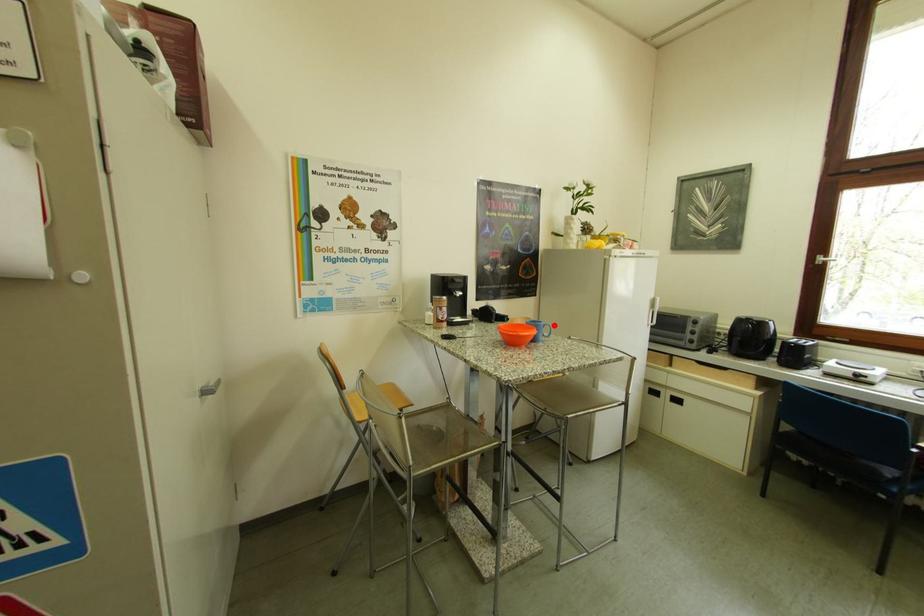
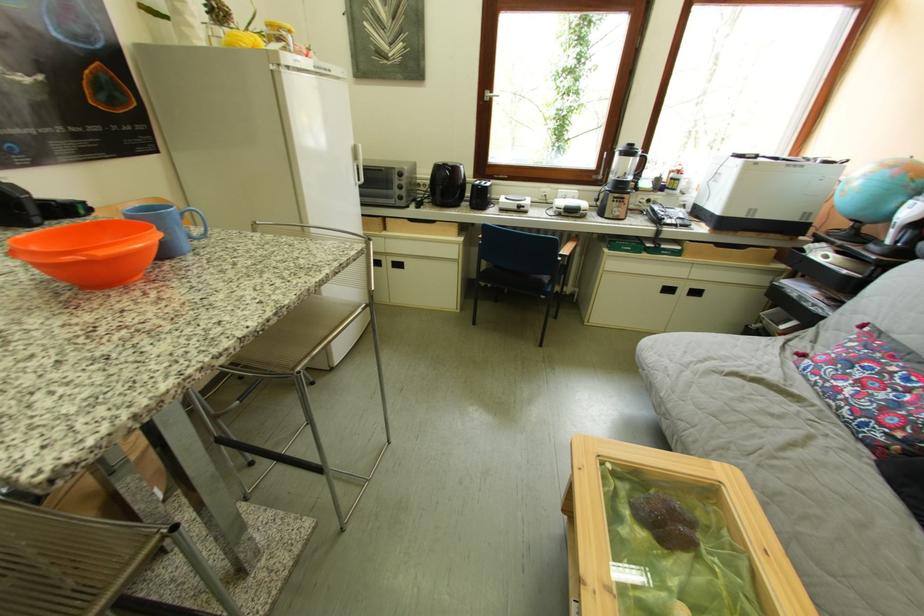
Find the pixel in the second image that matches the highlighted location in the first image.

(183, 209)